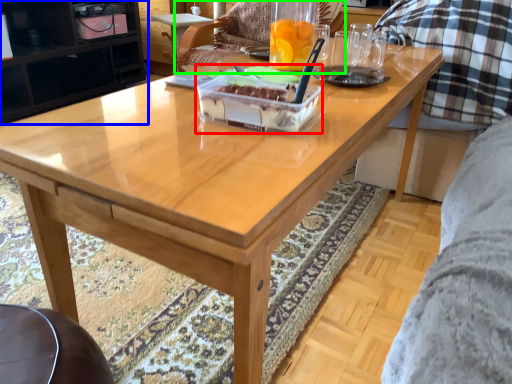
Question: Based on their relative distances, which object is farther from cake (highlighted by a red box)? Choose from cabinetry (highlighted by a blue box) and chair (highlighted by a green box).

Choices:
 (A) cabinetry
 (B) chair

Answer: (A)